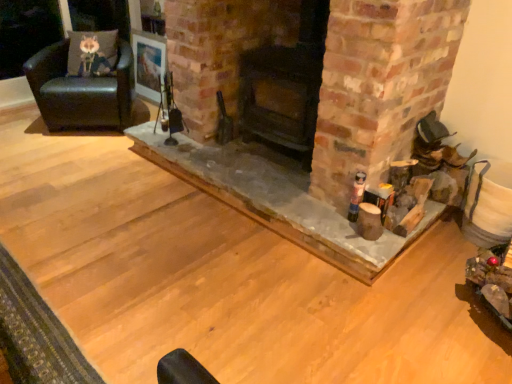
Question: Relative to dark brown wood stove at center, positioned as the 1th fireplace in right-to-left order, is fuzzy fabric pillow at upper left in front or behind?

Choices:
 (A) behind
 (B) front

Answer: (A)

Question: From the image's perspective, is fuzzy fabric pillow at upper left located above or below dark brown wood stove at center, positioned as the 1th fireplace in right-to-left order?

Choices:
 (A) above
 (B) below

Answer: (A)

Question: Estimate the real-world distances between objects in this image. Which object is closer to the fuzzy fabric pillow at upper left?

Choices:
 (A) black leather chair at left
 (B) smooth stone fireplace at center, which is the second fireplace in right-to-left order
 (C) dark brown wood stove at center, which appears as the second fireplace when viewed from the left
 (D) wooden frame at upper center

Answer: (A)

Question: Based on their relative distances, which object is farther from the black leather chair at left?

Choices:
 (A) smooth stone fireplace at center, which is the 1th fireplace in left-to-right order
 (B) wooden frame at upper center
 (C) fuzzy fabric pillow at upper left
 (D) dark brown wood stove at center, which appears as the second fireplace when viewed from the left

Answer: (D)